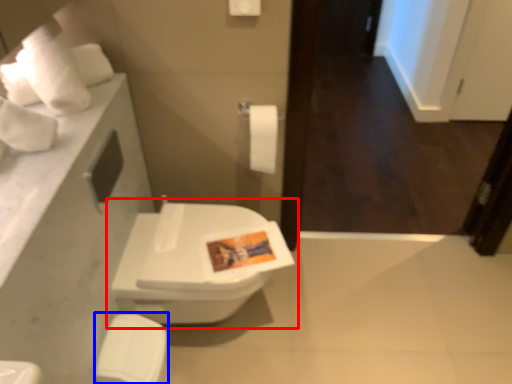
Question: Which of the following is the farthest to the observer, toilet (highlighted by a red box) or porcelain (highlighted by a blue box)?

Choices:
 (A) toilet
 (B) porcelain

Answer: (A)